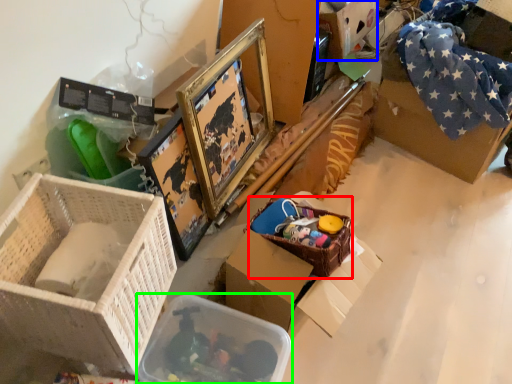
Question: Which is nearer to the basket (highlighted by a red box)? storage box (highlighted by a blue box) or storage box (highlighted by a green box).

Choices:
 (A) storage box
 (B) storage box

Answer: (B)